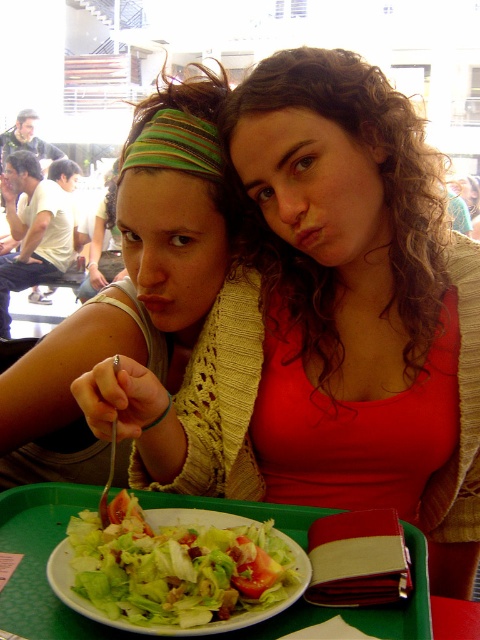
You are a photographer trying to capture a candid shot of the two people at the table. You want to ensure the matte green headband at center and the green plastic tray at center are both visible in the frame. Given their positions, which object should you focus on first to make sure both are in the shot?

The matte green headband at center is in front of the green plastic tray at center. Focus on the matte green headband at center first to ensure both are visible, as the tray is behind it.

You are a fashion designer observing two accessories at the center of the table in the dining area. Which accessory is bigger between the matte yellow scarf at center and the matte green headband at center?

The matte yellow scarf at center has a larger size compared to the matte green headband at center, so the matte yellow scarf at center is bigger.

You are a photographer taking a picture of the matte green headband at center and the green leafy salad at center. Which object will appear larger in the photo?

The matte green headband at center will appear larger in the photo because it is much taller than the green leafy salad at center.